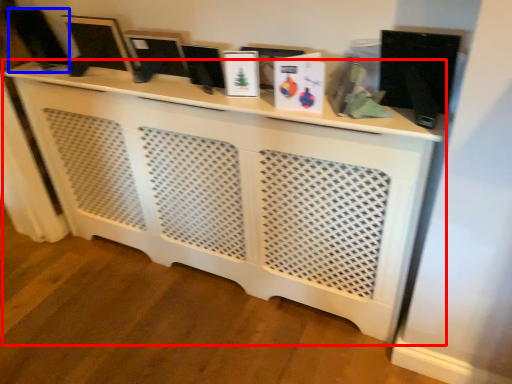
Question: Which point is closer to the camera, furniture (highlighted by a red box) or computer monitor (highlighted by a blue box)?

Choices:
 (A) furniture
 (B) computer monitor

Answer: (A)